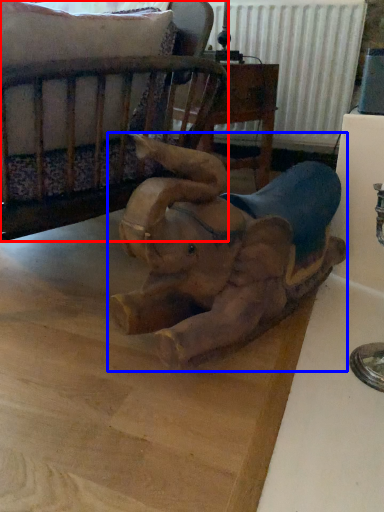
Question: Which object is further to the camera taking this photo, furniture (highlighted by a red box) or elephant (highlighted by a blue box)?

Choices:
 (A) furniture
 (B) elephant

Answer: (A)